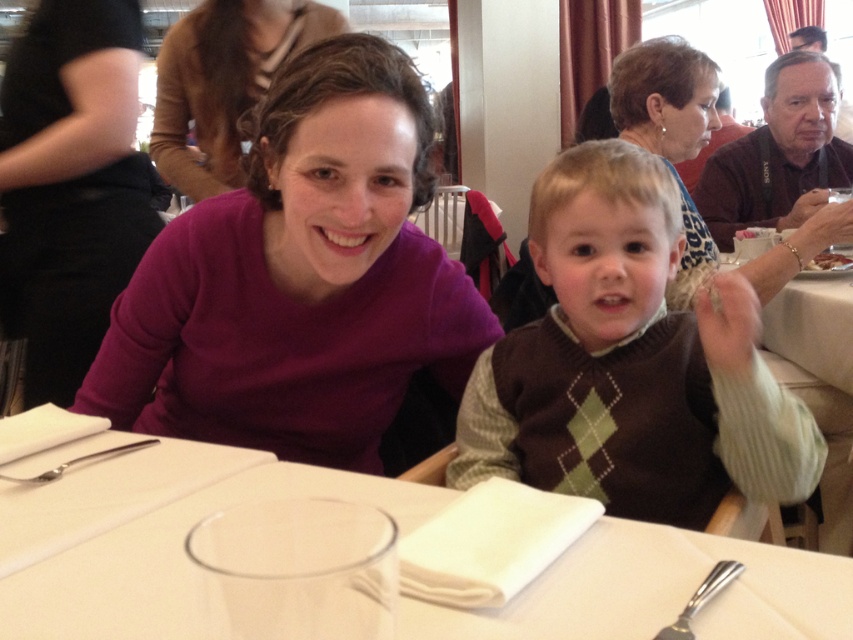
Where is the matte purple sweater at upper left located in the image?

The matte purple sweater at upper left is located at point (x=70, y=184) in the image.